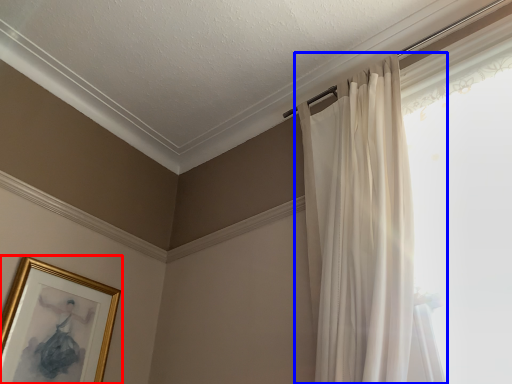
Question: Which object appears closest to the camera in this image, picture frame (highlighted by a red box) or curtain (highlighted by a blue box)?

Choices:
 (A) picture frame
 (B) curtain

Answer: (B)